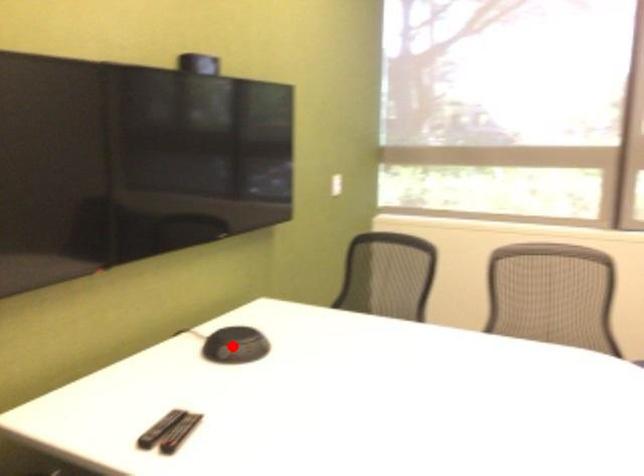
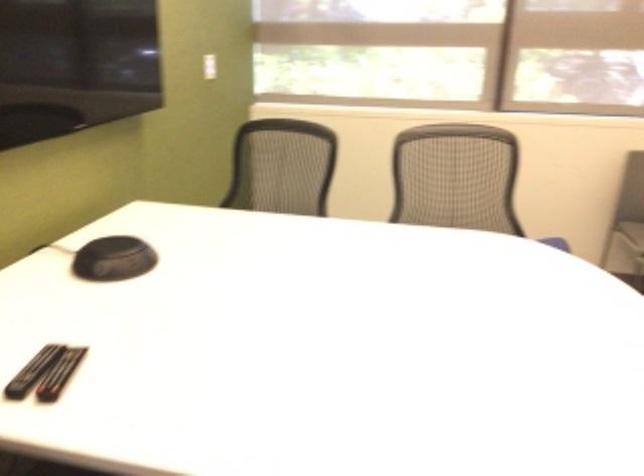
The point at the highlighted location is marked in the first image. Where is the corresponding point in the second image?

(113, 259)